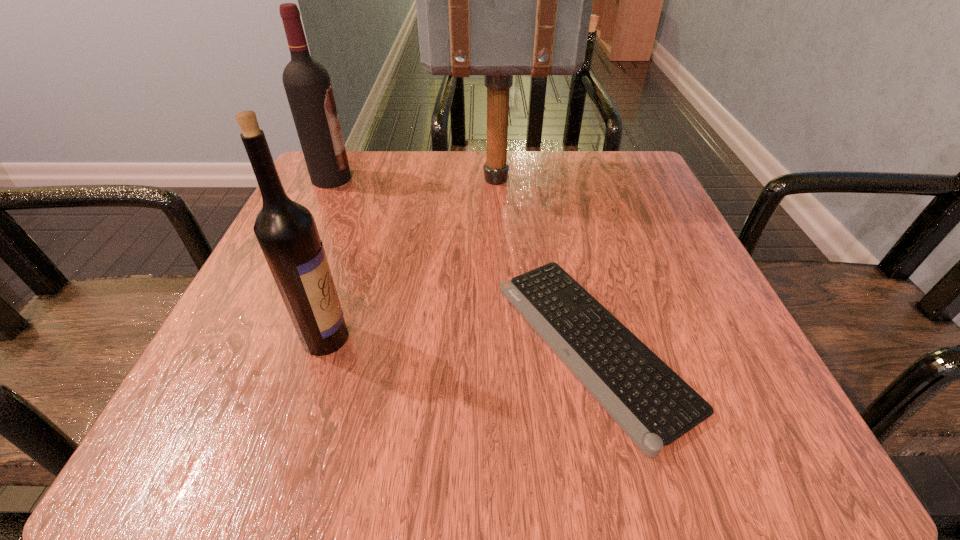
Locate an element on the screen. vacant space located on the label of the third object from right to left is located at coordinates (603, 338).

The image size is (960, 540). What are the coordinates of `vacant space located on the left of the computer keyboard` in the screenshot? It's located at (237, 345).

The height and width of the screenshot is (540, 960). Find the location of `mallet that is at the far edge`. mallet that is at the far edge is located at coordinates (498, 0).

Identify the location of wine bottle positioned at the far edge. (307, 84).

Image resolution: width=960 pixels, height=540 pixels. In order to click on object located in the near edge section of the desktop in this screenshot , I will do pos(654,406).

This screenshot has height=540, width=960. I want to click on object that is at the right edge, so click(654, 406).

You are a GUI agent. You are given a task and a screenshot of the screen. Output one action in this format:
    pyautogui.click(x=<x>, y=<y>)
    Task: Click on the object present at the far left corner
    The height and width of the screenshot is (540, 960).
    Given the screenshot: What is the action you would take?
    pyautogui.click(x=307, y=84)

Locate an element on the screen. The width and height of the screenshot is (960, 540). object located at the near right corner is located at coordinates (654, 406).

Locate an element on the screen. The image size is (960, 540). free space at the far edge is located at coordinates coord(516,188).

Identify the location of vacant space at the near edge of the desktop. (429, 442).